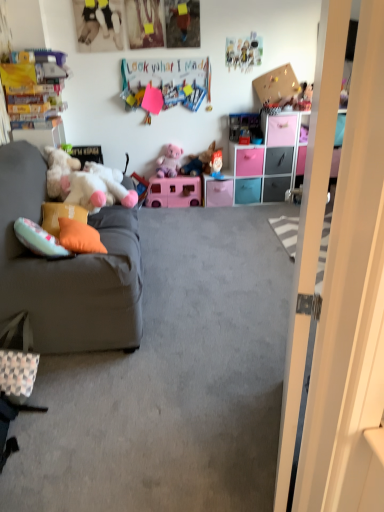
Question: Do you think blue fabric doll at center, which ranks as the third toy in left-to-right order, is within teal plastic drawer at center, the 4th drawer when ordered from right to left, or outside of it?

Choices:
 (A) outside
 (B) inside

Answer: (A)

Question: Is blue fabric doll at center, positioned as the fourth toy in top-to-bottom order, wider or thinner than teal plastic drawer at center, the 4th drawer when ordered from right to left?

Choices:
 (A) thin
 (B) wide

Answer: (A)

Question: Which object is the farthest from the pink plastic storage unit at center?

Choices:
 (A) velvet gray couch at left
 (B) orange fabric pillow at left, the 1th pillow positioned from the front
 (C) orange fabric pillow at left, the 2th pillow positioned from the front
 (D) pink plastic drawer at center, the third drawer from the right
 (E) teal plastic drawer at center, the 4th drawer when ordered from right to left

Answer: (B)

Question: Which object is the closest to the teal plastic drawer at center, the 4th drawer when ordered from right to left?

Choices:
 (A) matte black drawer at center, which is counted as the 1th drawer, starting from the right
 (B) plush purple teddy bear at center
 (C) white glossy door at right
 (D) blue fabric doll at center, positioned as the fourth toy in top-to-bottom order
 (E) plush pink teddy bear at upper right, the 2th toy viewed from the top

Answer: (A)